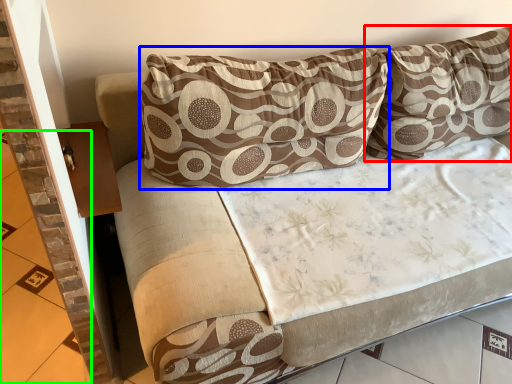
Question: Estimate the real-world distances between objects in this image. Which object is closer to pillow (highlighted by a red box), pillow (highlighted by a blue box) or tile (highlighted by a green box)?

Choices:
 (A) pillow
 (B) tile

Answer: (A)